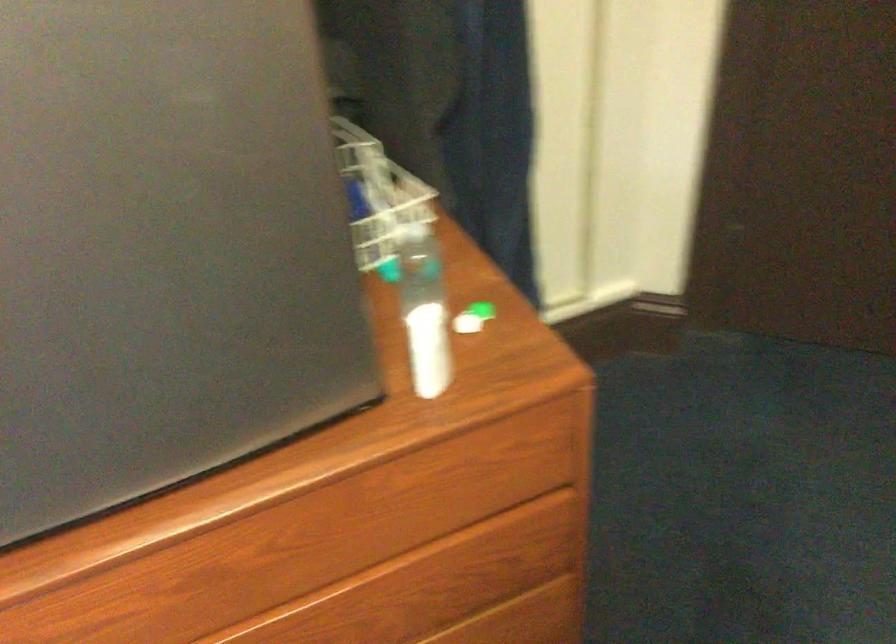
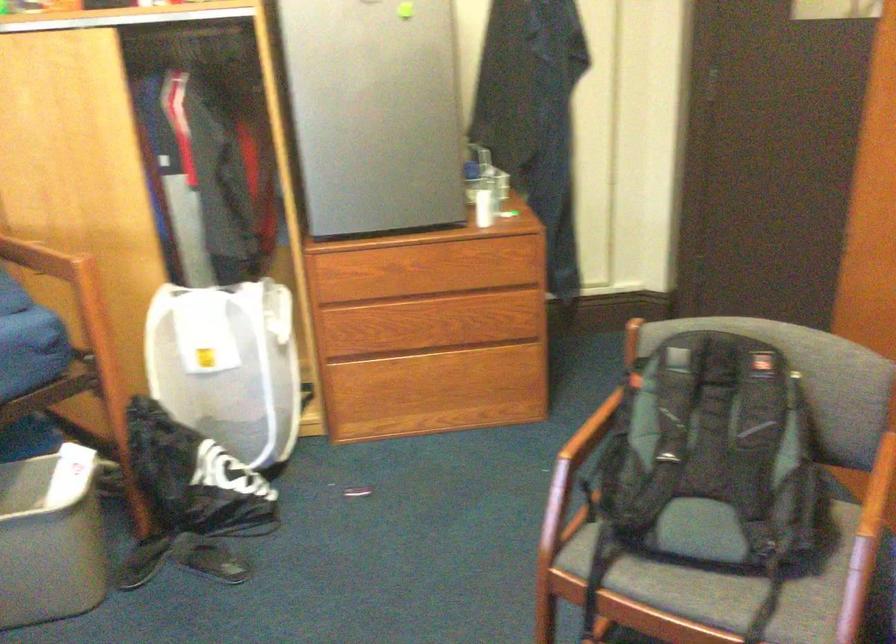
In a continuous first-person perspective shot, in which direction is the camera moving?

The cameraman walked toward right, backward.